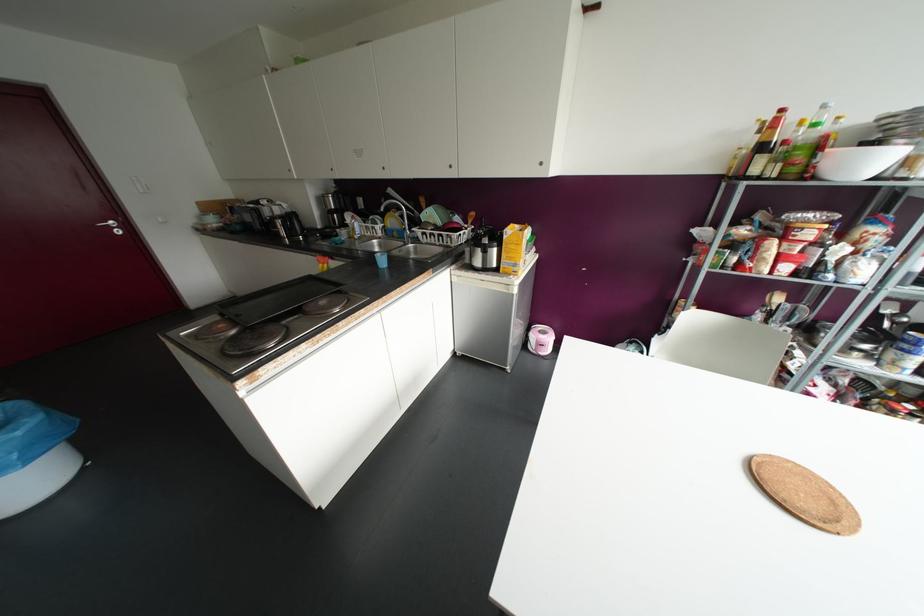
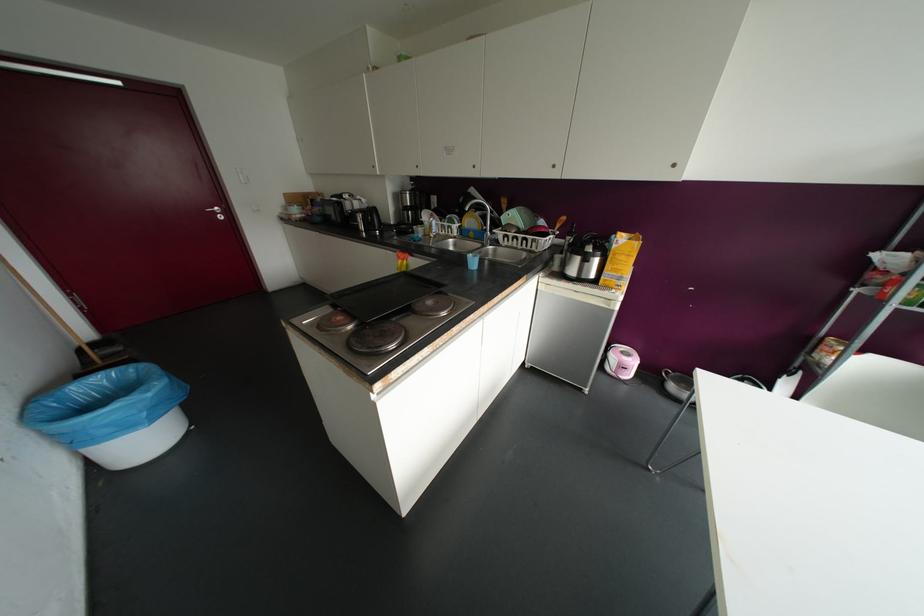
Locate, in the second image, the point that corresponds to point (110, 227) in the first image.

(214, 213)